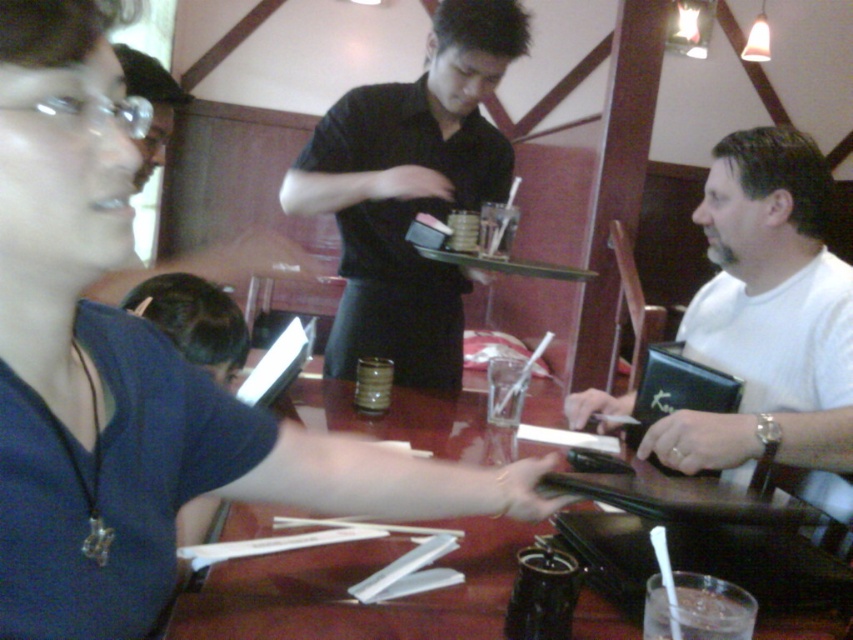
You are a customer at the restaurant and want to place your white matte wallet at right on the wooden table at center. Based on their sizes, will the wallet fit on the table?

The white matte wallet at right is taller than the wooden table at center, so it might not fit properly on the table due to its height difference.

You need to place a rectangular box that is 1.2 meters long on the wooden table at center. Considering the clear glass at table center is also on the table, will the box fit on the table without overlapping the glass?

The wooden table at center is wider than the clear glass at table center. However, the length of the table isn not mentioned in the objects description. Therefore, it is uncertain if the 1.2 meter long box will fit without overlapping the glass.

You are sitting at the table in the foreground of the restaurant scene. There is a point at coordinates (503, 456) that you want to reach with your hand. Can you comfortably reach that point without moving from your seat?

The point at coordinates (503, 456) is 1.51 meters away from the viewer. Since the average comfortable reaching distance for an adult is about 0.7 to 1.0 meters, you would likely not be able to comfortably reach that point without moving from your seat.